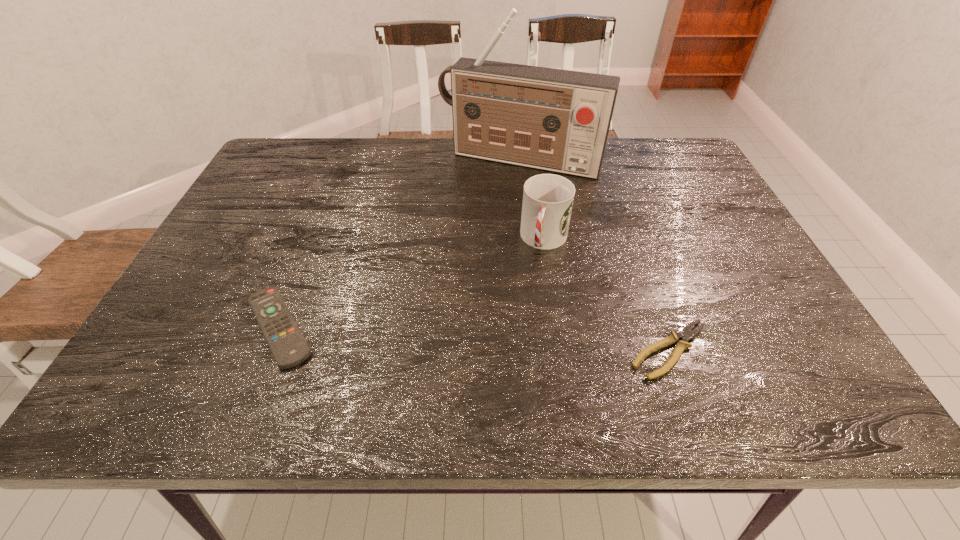
Identify the location of free space located on the side of the second farthest object where the handle is located. The width and height of the screenshot is (960, 540). (511, 361).

This screenshot has width=960, height=540. What are the coordinates of `vacant space located on the side of the second farthest object where the handle is located` in the screenshot? It's located at (512, 357).

Find the location of a particular element. The width and height of the screenshot is (960, 540). free space located 0.230m on the front panel of the tallest object is located at coordinates (470, 229).

Locate an element on the screen. vacant space located 0.250m on the front panel of the tallest object is located at coordinates (468, 234).

The height and width of the screenshot is (540, 960). What are the coordinates of `free space located 0.350m on the front panel of the tallest object` in the screenshot? It's located at (453, 260).

Find the location of a particular element. This screenshot has height=540, width=960. object present at the far edge is located at coordinates (557, 120).

Locate an element on the screen. The height and width of the screenshot is (540, 960). remote control present at the near edge is located at coordinates pyautogui.click(x=289, y=348).

The width and height of the screenshot is (960, 540). Find the location of `pliers that is at the near edge`. pliers that is at the near edge is located at coordinates (686, 333).

This screenshot has width=960, height=540. I want to click on object located at the left edge, so click(289, 348).

I want to click on object located at the near left corner, so click(289, 348).